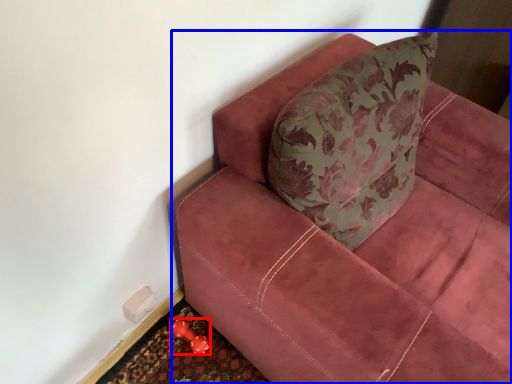
Question: Which of the following is the closest to the observer, toy (highlighted by a red box) or studio couch (highlighted by a blue box)?

Choices:
 (A) toy
 (B) studio couch

Answer: (B)